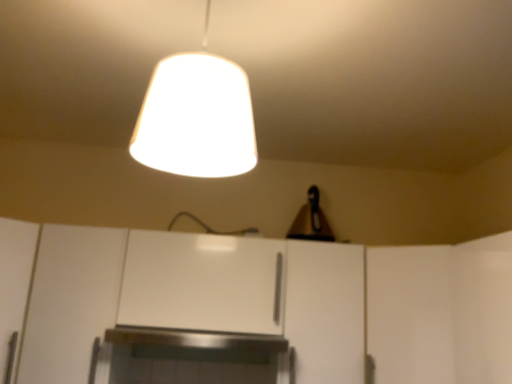
Question: From the image's perspective, is white matte cabinet at center, which ranks as the third cabinetry in left-to-right order, located above or below white matte cabinet at lower left, placed as the 1th cabinetry when sorted from left to right?

Choices:
 (A) below
 (B) above

Answer: (A)

Question: Which is correct: white matte cabinet at center, which ranks as the third cabinetry in left-to-right order, is inside white matte cabinet at lower left, which is counted as the 3th cabinetry, starting from the right, or outside of it?

Choices:
 (A) outside
 (B) inside

Answer: (A)

Question: Which object is the farthest from the white matte door at right?

Choices:
 (A) white matte lampshade at upper center
 (B) white matte cabinet at lower left, placed as the 1th cabinetry when sorted from left to right
 (C) white matte cabinet at center, which is counted as the first cabinetry, starting from the right
 (D) white matte cabinet at center, which ranks as the 2th cabinetry in right-to-left order

Answer: (B)

Question: Considering the real-world distances, which object is farthest from the white matte door at right?

Choices:
 (A) white matte cabinet at center, which ranks as the third cabinetry in left-to-right order
 (B) white matte cabinet at lower left, which is counted as the 3th cabinetry, starting from the right
 (C) white matte cabinet at center, which ranks as the 2th cabinetry in right-to-left order
 (D) white matte lampshade at upper center

Answer: (B)